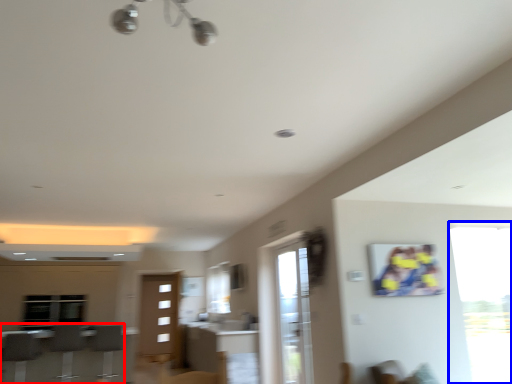
Question: Which point is further to the camera, furniture (highlighted by a red box) or window (highlighted by a blue box)?

Choices:
 (A) furniture
 (B) window

Answer: (A)